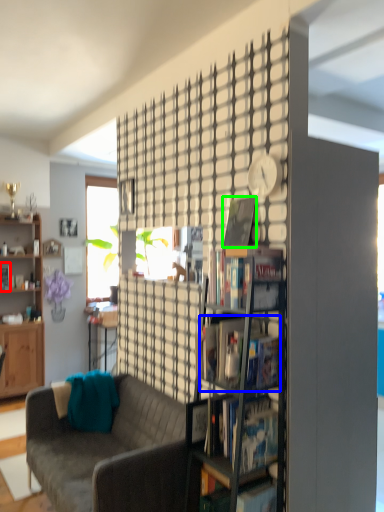
Question: Which object is positioned closest to book (highlighted by a red box)? Select from book (highlighted by a blue box) and book (highlighted by a green box).

Choices:
 (A) book
 (B) book

Answer: (B)